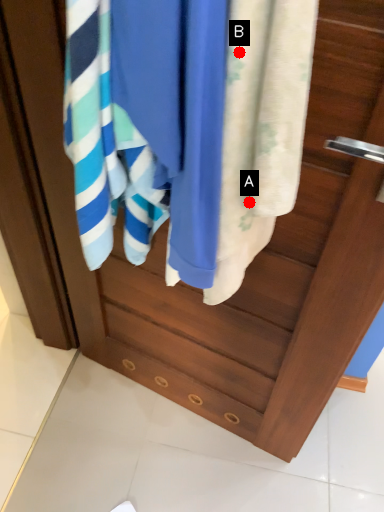
Question: Two points are circled on the image, labeled by A and B beside each circle. Among these points, which one is farthest from the camera?

Choices:
 (A) A is further
 (B) B is further

Answer: (A)